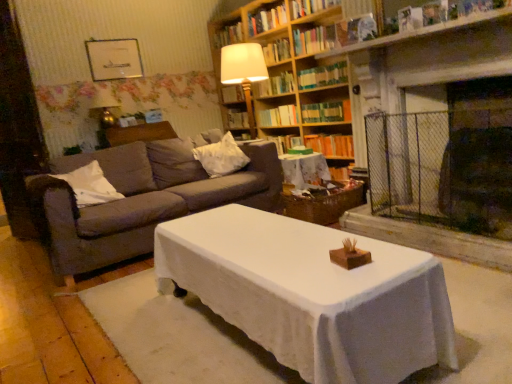
Where is `woven brown basket at lower center`? The image size is (512, 384). woven brown basket at lower center is located at coordinates (324, 203).

Describe the element at coordinates (314, 40) in the screenshot. The image size is (512, 384). I see `hardcover book at upper center, positioned as the 4th book in top-to-bottom order` at that location.

Measure the distance between matte gold table lamp at upper left and camera.

They are 14.74 feet apart.

The width and height of the screenshot is (512, 384). Identify the location of matte gold table lamp at upper left. (105, 108).

Describe the element at coordinates (304, 169) in the screenshot. The width and height of the screenshot is (512, 384). I see `white cloth-covered table at center` at that location.

Find the location of a particular element. metallic silver picture frame at upper center is located at coordinates (114, 59).

I want to click on orange hardcover book at center, arranged as the first book when ordered from the bottom, so click(331, 145).

Find the location of a particular element. The width and height of the screenshot is (512, 384). woven brown basket at lower center is located at coordinates (324, 203).

Looking at this image, from the image's perspective, is hardcover book at upper center, positioned as the 4th book in top-to-bottom order, on top of hardcover book at upper center, the 10th book positioned from the bottom?

No, from the image's perspective, hardcover book at upper center, positioned as the 4th book in top-to-bottom order, is not above hardcover book at upper center, the 10th book positioned from the bottom.

Does hardcover book at upper center, positioned as the 4th book in top-to-bottom order, have a larger size compared to hardcover book at upper center, the 1th book from the top?

Indeed, hardcover book at upper center, positioned as the 4th book in top-to-bottom order, has a larger size compared to hardcover book at upper center, the 1th book from the top.

Based on the photo, does hardcover book at upper center, positioned as the 4th book in top-to-bottom order, contain hardcover book at upper center, the 10th book positioned from the bottom?

No, hardcover book at upper center, the 10th book positioned from the bottom, is not surrounded by hardcover book at upper center, positioned as the 4th book in top-to-bottom order.

Can we say hardcover book at center, which ranks as the ninth book in top-to-bottom order, lies outside wooden bookshelf at upper center?

That's incorrect, hardcover book at center, which ranks as the ninth book in top-to-bottom order, is not completely outside wooden bookshelf at upper center.

Between point (297, 137) and point (242, 104), which one is positioned in front?

Point (297, 137)

Between hardcover book at center, which ranks as the ninth book in top-to-bottom order, and wooden bookshelf at upper center, which one has larger size?

Bigger between the two is wooden bookshelf at upper center.

Does hardcover book at center, which ranks as the ninth book in top-to-bottom order, appear on the left side of wooden bookshelf at upper center?

Incorrect, hardcover book at center, which ranks as the ninth book in top-to-bottom order, is not on the left side of wooden bookshelf at upper center.

Based on the photo, from a real-world perspective, is green paperback book at upper center, acting as the fifth book starting from the bottom, physically located above or below metallic silver picture frame at upper center?

green paperback book at upper center, acting as the fifth book starting from the bottom, is below metallic silver picture frame at upper center.

Could you tell me if green paperback book at upper center, acting as the fifth book starting from the bottom, is turned towards metallic silver picture frame at upper center?

No, green paperback book at upper center, acting as the fifth book starting from the bottom, is not turned towards metallic silver picture frame at upper center.

Can we say green paperback book at upper center, placed as the 6th book when sorted from top to bottom, lies outside metallic silver picture frame at upper center?

That's correct, green paperback book at upper center, placed as the 6th book when sorted from top to bottom, is outside of metallic silver picture frame at upper center.

Does green paperback book at upper center, placed as the 6th book when sorted from top to bottom, have a smaller size compared to metallic silver picture frame at upper center?

No, green paperback book at upper center, placed as the 6th book when sorted from top to bottom, is not smaller than metallic silver picture frame at upper center.

Based on their positions, is hardcover book at upper center, the eighth book ordered from the bottom, located to the left or right of matte gold table lamp at upper left?

In the image, hardcover book at upper center, the eighth book ordered from the bottom, appears on the right side of matte gold table lamp at upper left.

Who is taller, hardcover book at upper center, marked as the 3th book in a top-to-bottom arrangement, or matte gold table lamp at upper left?

Standing taller between the two is matte gold table lamp at upper left.

From a real-world perspective, relative to matte gold table lamp at upper left, is hardcover book at upper center, marked as the 3th book in a top-to-bottom arrangement, vertically above or below?

hardcover book at upper center, marked as the 3th book in a top-to-bottom arrangement, is situated higher than matte gold table lamp at upper left in the real world.

Is hardcover book at upper center, the 1th book from the top, facing towards white soft pillow at center, positioned as the first pillow in right-to-left order?

No, hardcover book at upper center, the 1th book from the top, is not facing towards white soft pillow at center, positioned as the first pillow in right-to-left order.

Is point (232, 38) closer to camera compared to point (243, 165)?

No, (232, 38) is behind (243, 165).

How different are the orientations of hardcover book at upper center, the 10th book positioned from the bottom, and white soft pillow at center, the second pillow in the left-to-right sequence, in degrees?

The angle between the facing direction of hardcover book at upper center, the 10th book positioned from the bottom, and the facing direction of white soft pillow at center, the second pillow in the left-to-right sequence, is 88.9 degrees.

Would you consider hardcover book at upper center, the eighth book ordered from the bottom, to be distant from woven brown basket at lower center?

Indeed, hardcover book at upper center, the eighth book ordered from the bottom, is not near woven brown basket at lower center.

Can you confirm if hardcover book at upper center, marked as the 3th book in a top-to-bottom arrangement, is smaller than woven brown basket at lower center?

Yes, hardcover book at upper center, marked as the 3th book in a top-to-bottom arrangement, is smaller than woven brown basket at lower center.

Which is farther, [325,7] or [356,189]?

Positioned behind is point [325,7].

In the scene shown: Considering the relative sizes of green paperback book at upper center, placed as the 6th book when sorted from top to bottom, and dark gray fabric couch at left in the image provided, is green paperback book at upper center, placed as the 6th book when sorted from top to bottom, smaller than dark gray fabric couch at left?

Indeed, green paperback book at upper center, placed as the 6th book when sorted from top to bottom, has a smaller size compared to dark gray fabric couch at left.

From the image's perspective, between green paperback book at upper center, acting as the fifth book starting from the bottom, and dark gray fabric couch at left, who is located below?

dark gray fabric couch at left.

In the scene shown: Is green paperback book at upper center, acting as the fifth book starting from the bottom, looking in the opposite direction of dark gray fabric couch at left?

green paperback book at upper center, acting as the fifth book starting from the bottom, does not have its back to dark gray fabric couch at left.

Considering the sizes of objects green paperback book at upper center, placed as the 6th book when sorted from top to bottom, and dark gray fabric couch at left in the image provided, who is thinner, green paperback book at upper center, placed as the 6th book when sorted from top to bottom, or dark gray fabric couch at left?

green paperback book at upper center, placed as the 6th book when sorted from top to bottom.

The image size is (512, 384). There is a hardcover book at upper center, the 1th book from the top. Identify the location of the 3rd book below it (from the image's perspective). click(x=314, y=40).

You are a GUI agent. You are given a task and a screenshot of the screen. Output one action in this format:
    pyautogui.click(x=<x>, y=<y>)
    Task: Click on the 9th book behind when counting from the wooden bookshelf at upper center
    
    Given the screenshot: What is the action you would take?
    pyautogui.click(x=285, y=142)

Estimate the real-world distances between objects in this image. Which object is further from orange hardcover book at center, arranged as the first book when ordered from the bottom, metallic silver picture frame at upper center or hardcover book at center, positioned as the 4th book in bottom-to-top order?

metallic silver picture frame at upper center is positioned further to the anchor orange hardcover book at center, arranged as the first book when ordered from the bottom.

Based on their spatial positions, is hardcover book at upper center, positioned as the 4th book in top-to-bottom order, or woven brown basket at lower center further from matte gold table lamp at upper left?

woven brown basket at lower center lies further to matte gold table lamp at upper left than the other object.

Looking at the image, which one is located closer to white cloth-covered table at center, hardcover book at center, which ranks as the ninth book in top-to-bottom order, or hardcover book at upper center, the eighth book ordered from the bottom?

Based on the image, hardcover book at center, which ranks as the ninth book in top-to-bottom order, appears to be nearer to white cloth-covered table at center.

Based on their spatial positions, is wooden bookshelf at upper center or woven brown basket at lower center closer to white cloth-covered table at center?

Based on the image, woven brown basket at lower center appears to be nearer to white cloth-covered table at center.

Which object lies nearer to the anchor point wooden bookshelf at upper center, hardcover book at center, the 2th book ordered from the bottom, or hardcover book at upper center, which is the 5th book in top-to-bottom order?

The object closer to wooden bookshelf at upper center is hardcover book at upper center, which is the 5th book in top-to-bottom order.

In the scene shown: From the image, which object appears to be nearer to white soft pillow at center, marked as the 2th pillow in a front-to-back arrangement, metallic silver picture frame at upper center or hardcover book at center, the 7th book positioned from the top?

Among the two, hardcover book at center, the 7th book positioned from the top, is located nearer to white soft pillow at center, marked as the 2th pillow in a front-to-back arrangement.

In the scene shown: When comparing their distances from hardcover book at upper center, arranged as the 9th book when ordered from the bottom, does white soft pillow at center, the second pillow in the left-to-right sequence, or dark gray fabric couch at left seem further?

The object further to hardcover book at upper center, arranged as the 9th book when ordered from the bottom, is dark gray fabric couch at left.

Looking at the image, which one is located further to white cloth-covered coffee table at center, hardcover book at center, the 2th book ordered from the bottom, or dark gray fabric couch at left?

Based on the image, hardcover book at center, the 2th book ordered from the bottom, appears to be further to white cloth-covered coffee table at center.

Image resolution: width=512 pixels, height=384 pixels. Find the location of `bookcase positioned between white cloth-covered coffee table at center and matte gold table lamp at upper left from near to far`. bookcase positioned between white cloth-covered coffee table at center and matte gold table lamp at upper left from near to far is located at coordinates (281, 72).

The image size is (512, 384). In order to click on table located between white soft pillow at center, the first pillow from the back, and orange hardcover book at center, arranged as the first book when ordered from the bottom, in the left-right direction in this screenshot , I will do `click(304, 169)`.

The image size is (512, 384). I want to click on picture frame located between matte gold table lamp at upper left and hardcover book at upper center, which is the 5th book in top-to-bottom order, in the left-right direction, so click(x=114, y=59).

Locate an element on the screen. This screenshot has height=384, width=512. bookcase between hardcover book at upper center, the eighth book ordered from the bottom, and dark gray fabric couch at left from top to bottom is located at coordinates (281, 72).